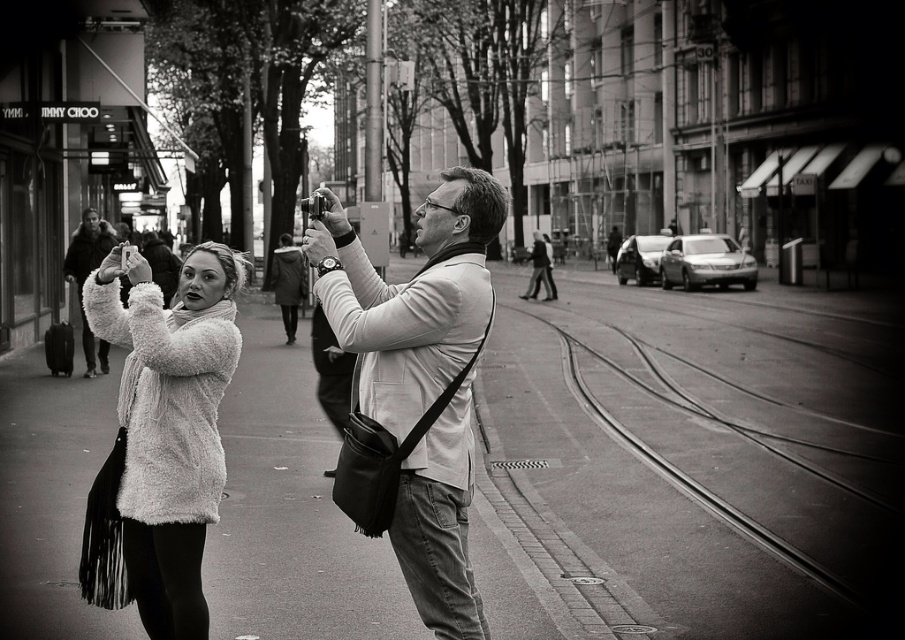
Is matte black camera at center above fuzzy white coat at left?

Indeed, matte black camera at center is positioned over fuzzy white coat at left.

Who is more distant from viewer, (x=427, y=502) or (x=189, y=410)?

Positioned behind is point (x=189, y=410).

Between point (421, 356) and point (224, 472), which one is positioned behind?

The point (224, 472) is more distant.

The image size is (905, 640). What are the coordinates of `matte black camera at center` in the screenshot? It's located at (415, 387).

Is matte black camera at center bigger than matte white jacket at center?

Yes.

This screenshot has height=640, width=905. Describe the element at coordinates (415, 387) in the screenshot. I see `matte black camera at center` at that location.

The width and height of the screenshot is (905, 640). What are the coordinates of `matte black camera at center` in the screenshot? It's located at (415, 387).

Does fuzzy white coat at center have a greater height compared to matte white jacket at center?

Incorrect, fuzzy white coat at center's height is not larger of matte white jacket at center's.

From the picture: Who is more forward, [383,355] or [106,355]?

Positioned in front is point [383,355].

This screenshot has width=905, height=640. I want to click on fuzzy white coat at center, so click(x=421, y=376).